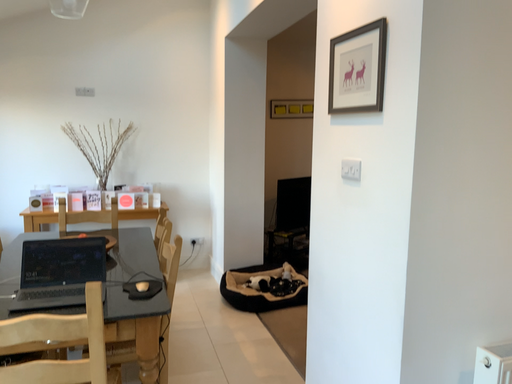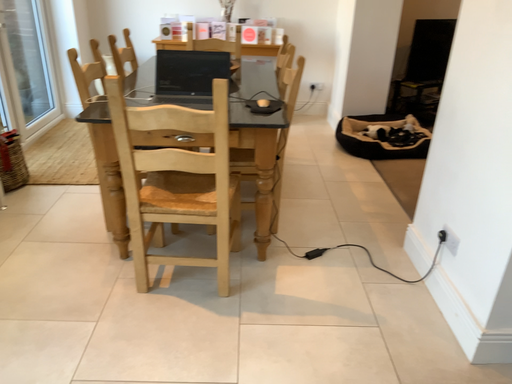
Question: How did the camera likely rotate when shooting the video?

Choices:
 (A) rotated left
 (B) rotated right

Answer: (A)